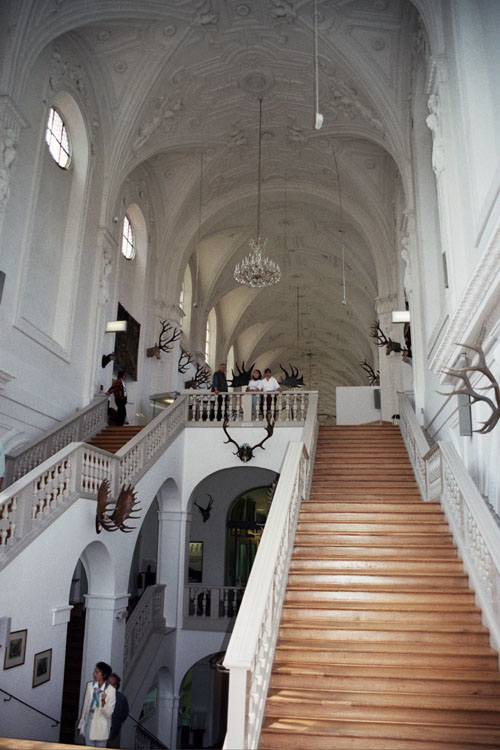
Identify the location of dark brown antlers on wall. (130, 500), (102, 510).